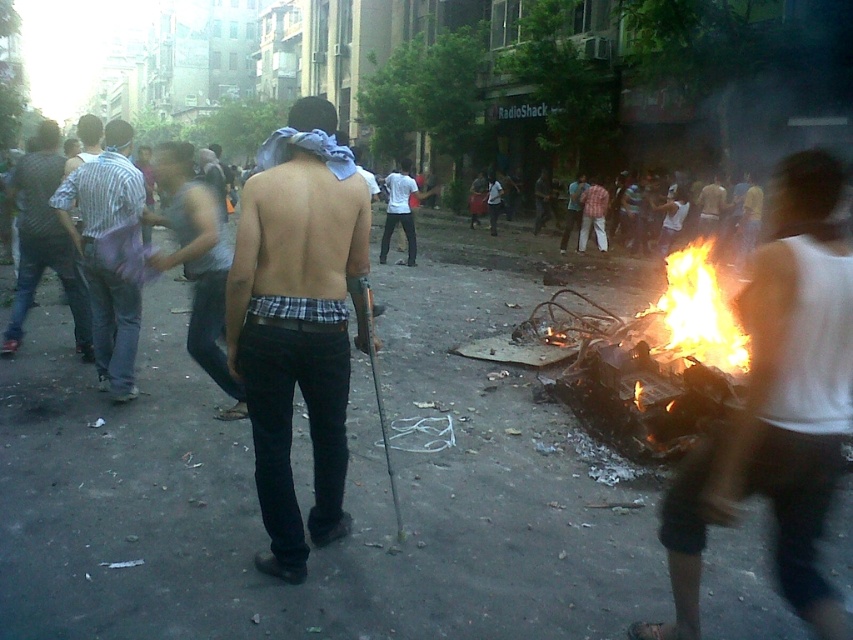
Which of these two, plaid fabric shirt at center or flaming debris at right, stands taller?

flaming debris at right is taller.

Which is in front, point (306, 134) or point (717, 289)?

Point (306, 134) is more forward.

Is point (251, 291) closer to camera compared to point (672, 253)?

Yes, it is.

At what (x,y) coordinates should I click in order to perform the action: click on plaid fabric shirt at center. Please return your answer as a coordinate pair (x, y). This screenshot has height=640, width=853. Looking at the image, I should click on (299, 321).

Image resolution: width=853 pixels, height=640 pixels. I want to click on plaid fabric shirt at center, so click(299, 321).

What do you see at coordinates (299, 321) in the screenshot?
I see `plaid fabric shirt at center` at bounding box center [299, 321].

This screenshot has width=853, height=640. In order to click on plaid fabric shirt at center in this screenshot , I will do `click(299, 321)`.

Is striped shirt at center wider than white shirt at center?

In fact, striped shirt at center might be narrower than white shirt at center.

Measure the distance from striped shirt at center to white shirt at center.

striped shirt at center and white shirt at center are 30.67 feet apart from each other.

Does point (122, 212) lie behind point (383, 184)?

No, it is not.

The width and height of the screenshot is (853, 640). What are the coordinates of `striped shirt at center` in the screenshot? It's located at (97, 256).